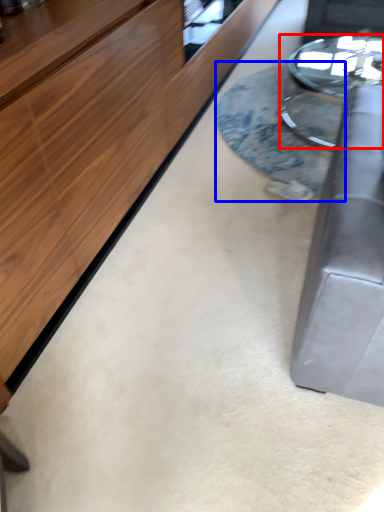
Question: Which object is further to the camera taking this photo, table (highlighted by a red box) or table (highlighted by a blue box)?

Choices:
 (A) table
 (B) table

Answer: (A)